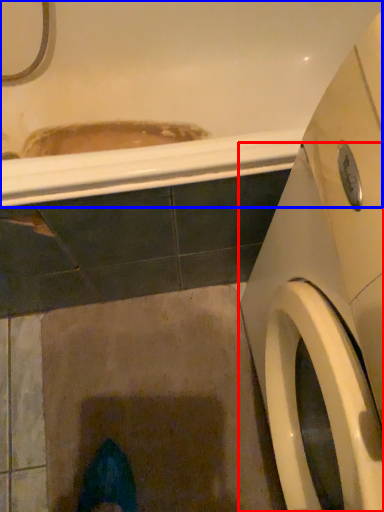
Question: Which point is further to the camera, washing machine (highlighted by a red box) or bath (highlighted by a blue box)?

Choices:
 (A) washing machine
 (B) bath

Answer: (B)